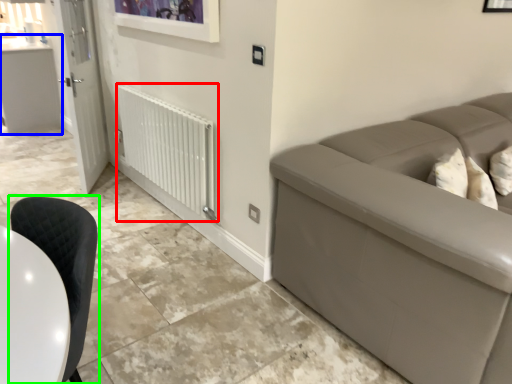
Question: Estimate the real-world distances between objects in this image. Which object is farther from radiator (highlighted by a red box), counter top (highlighted by a blue box) or chair (highlighted by a green box)?

Choices:
 (A) counter top
 (B) chair

Answer: (A)